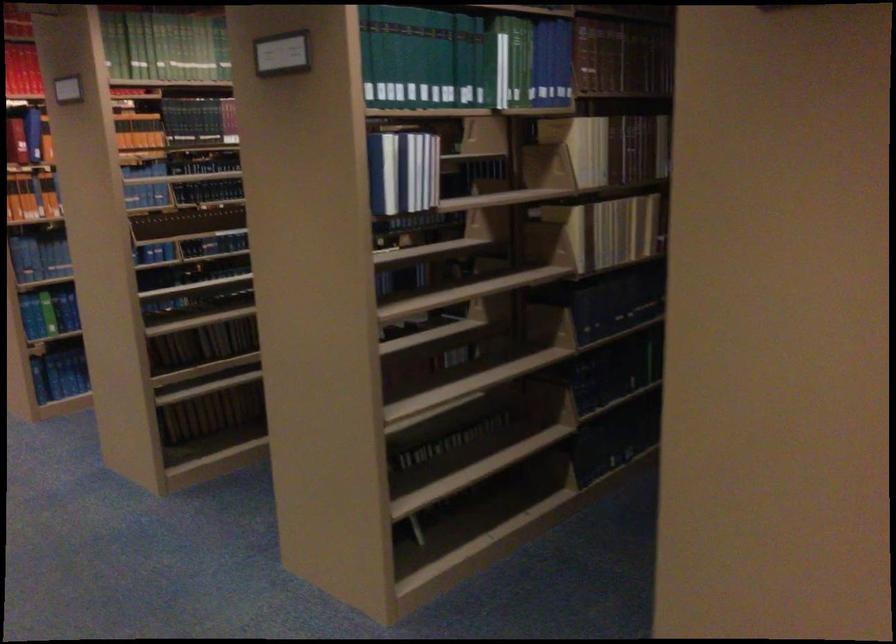
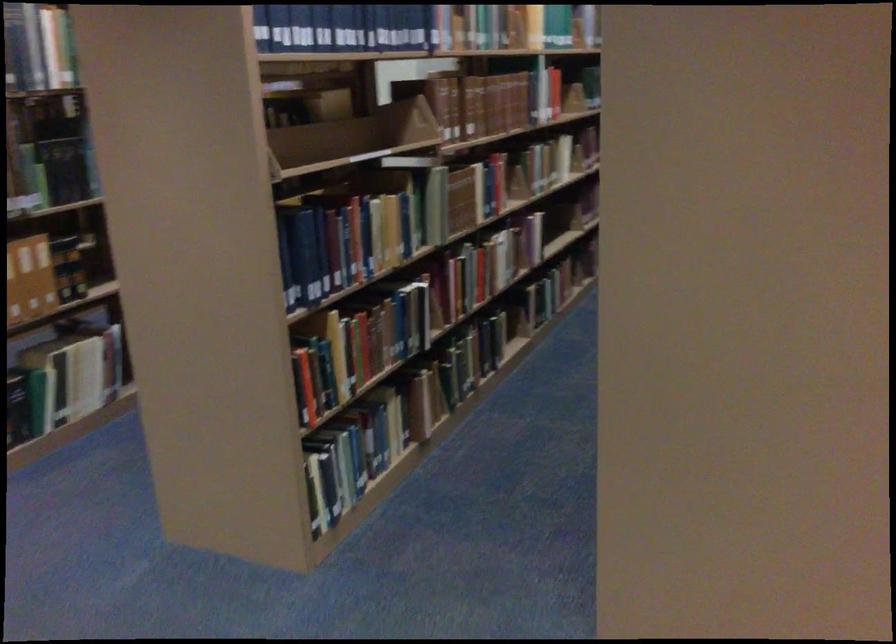
In the scene shown: Which direction would the cameraman need to move to produce the second image?

The movement direction of the cameraman is right, backward.